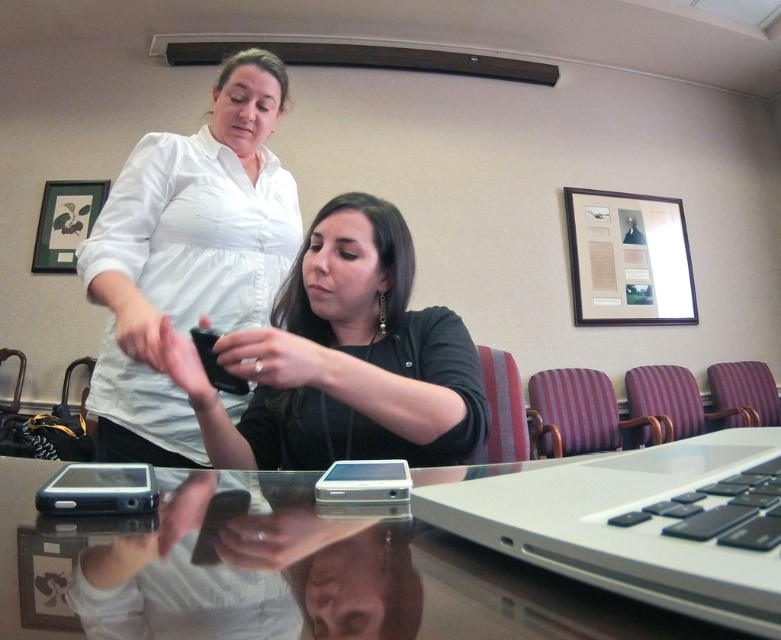
Question: Which object is positioned closest to the silver metallic phone at center?

Choices:
 (A) white matte shirt at upper left
 (B) black matte phone at center
 (C) transparent glass table at center
 (D) black matte phone at lower left

Answer: (C)

Question: Is silver metallic laptop at lower right to the right of silver metallic phone at center from the viewer's perspective?

Choices:
 (A) yes
 (B) no

Answer: (A)

Question: Can you confirm if transparent glass table at center is positioned below white matte shirt at upper left?

Choices:
 (A) yes
 (B) no

Answer: (A)

Question: Which of the following is the farthest from the observer?

Choices:
 (A) (204, 358)
 (B) (270, 444)
 (C) (95, 470)

Answer: (B)

Question: In this image, where is silver metallic laptop at lower right located relative to black matte phone at center?

Choices:
 (A) above
 (B) below

Answer: (B)

Question: Based on their relative distances, which object is farther from the silver metallic phone at center?

Choices:
 (A) black matte phone at lower left
 (B) black matte phone at center
 (C) white matte shirt at upper left
 (D) silver metallic laptop at lower right

Answer: (C)